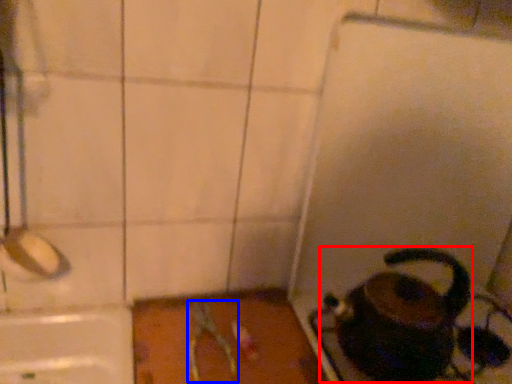
Question: Which of the following is the closest to the observer, coffeepot (highlighted by a red box) or scissors (highlighted by a blue box)?

Choices:
 (A) coffeepot
 (B) scissors

Answer: (A)